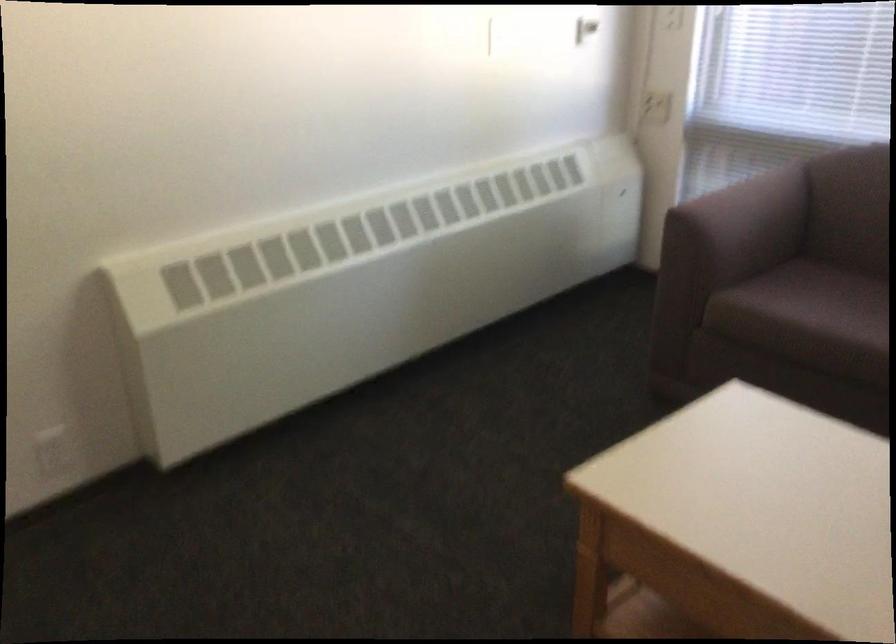
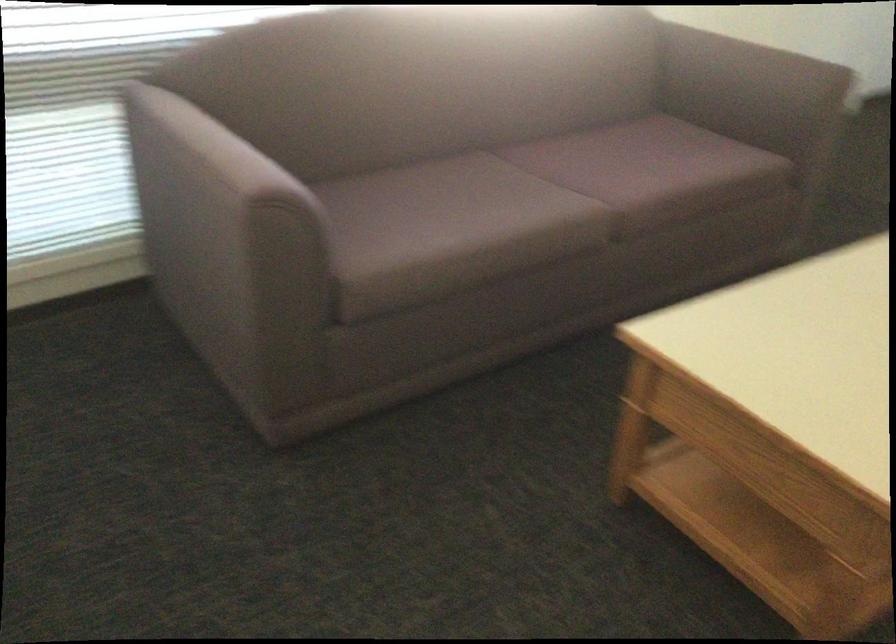
The point at (x=716, y=190) is marked in the first image. Where is the corresponding point in the second image?

(216, 147)